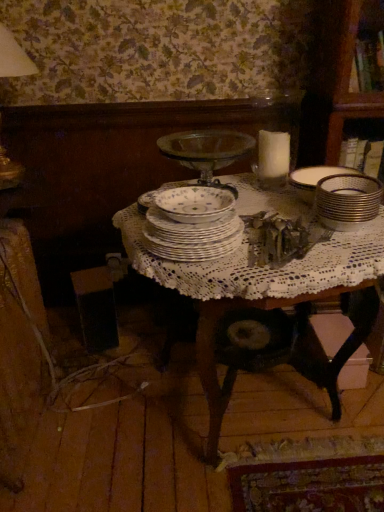
I want to click on vacant space underneath porcelain floral bowl at center (from a real-world perspective), so click(x=201, y=203).